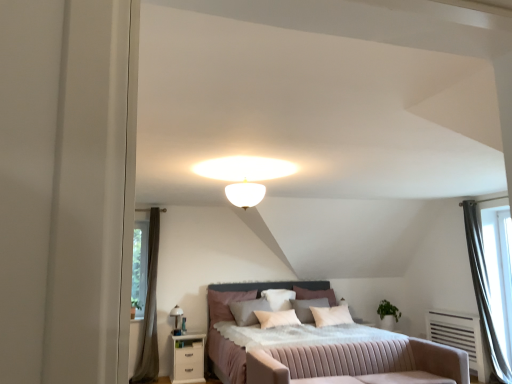
Question: Is white soft pillow at center, which is counted as the second pillow, starting from the right, completely or partially inside matte white table lamp at upper center?

Choices:
 (A) no
 (B) yes

Answer: (A)

Question: Is matte white table lamp at upper center to the left of white soft pillow at center, acting as the 2th pillow starting from the left, from the viewer's perspective?

Choices:
 (A) yes
 (B) no

Answer: (A)

Question: Is matte white table lamp at upper center not close to white soft pillow at center, which is counted as the second pillow, starting from the right?

Choices:
 (A) no
 (B) yes

Answer: (B)

Question: From a real-world perspective, is matte white table lamp at upper center on top of white soft pillow at center, acting as the 2th pillow starting from the left?

Choices:
 (A) yes
 (B) no

Answer: (B)

Question: Does matte white table lamp at upper center lie behind white soft pillow at center, which is counted as the second pillow, starting from the right?

Choices:
 (A) yes
 (B) no

Answer: (B)

Question: From the image's perspective, is matte white table lamp at upper center beneath white soft pillow at center, acting as the 2th pillow starting from the left?

Choices:
 (A) yes
 (B) no

Answer: (A)

Question: Can you confirm if brown fabric curtain at left, the first curtain in the left-to-right sequence, is thinner than matte white table lamp at upper center?

Choices:
 (A) yes
 (B) no

Answer: (B)

Question: From a real-world perspective, is brown fabric curtain at left, which is counted as the 2th curtain, starting from the right, over matte white table lamp at upper center?

Choices:
 (A) no
 (B) yes

Answer: (B)

Question: Could you tell me if brown fabric curtain at left, the first curtain in the left-to-right sequence, is facing matte white table lamp at upper center?

Choices:
 (A) yes
 (B) no

Answer: (B)

Question: Is brown fabric curtain at left, the first curtain in the left-to-right sequence, directly adjacent to matte white table lamp at upper center?

Choices:
 (A) no
 (B) yes

Answer: (A)

Question: Is brown fabric curtain at left, which is counted as the 2th curtain, starting from the right, positioned beyond the bounds of matte white table lamp at upper center?

Choices:
 (A) yes
 (B) no

Answer: (A)

Question: Considering the relative sizes of brown fabric curtain at left, which is counted as the 2th curtain, starting from the right, and matte white table lamp at upper center in the image provided, is brown fabric curtain at left, which is counted as the 2th curtain, starting from the right, wider than matte white table lamp at upper center?

Choices:
 (A) no
 (B) yes

Answer: (B)

Question: Does white glass ceiling light at center have a lesser height compared to velvet-like pink pillow at center, which is the first pillow from left to right?

Choices:
 (A) yes
 (B) no

Answer: (A)